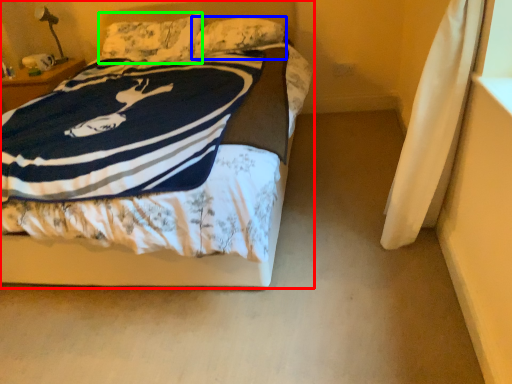
Question: Based on their relative distances, which object is nearer to bed (highlighted by a red box)? Choose from pillow (highlighted by a blue box) and pillow (highlighted by a green box).

Choices:
 (A) pillow
 (B) pillow

Answer: (A)